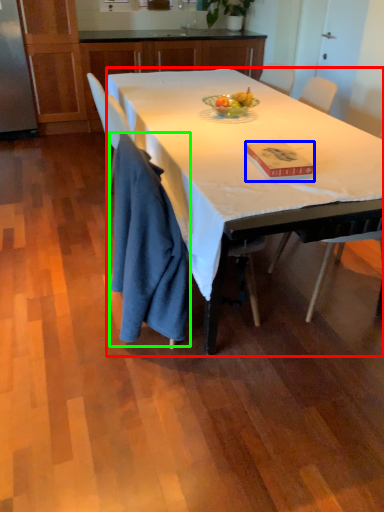
Question: Based on their relative distances, which object is nearer to desk (highlighted by a red box)? Choose from book (highlighted by a blue box) and cloth (highlighted by a green box).

Choices:
 (A) book
 (B) cloth

Answer: (A)